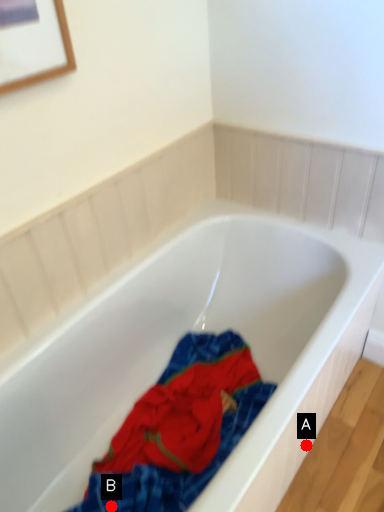
Question: Two points are circled on the image, labeled by A and B beside each circle. Which point appears closest to the camera in this image?

Choices:
 (A) A is closer
 (B) B is closer

Answer: (B)